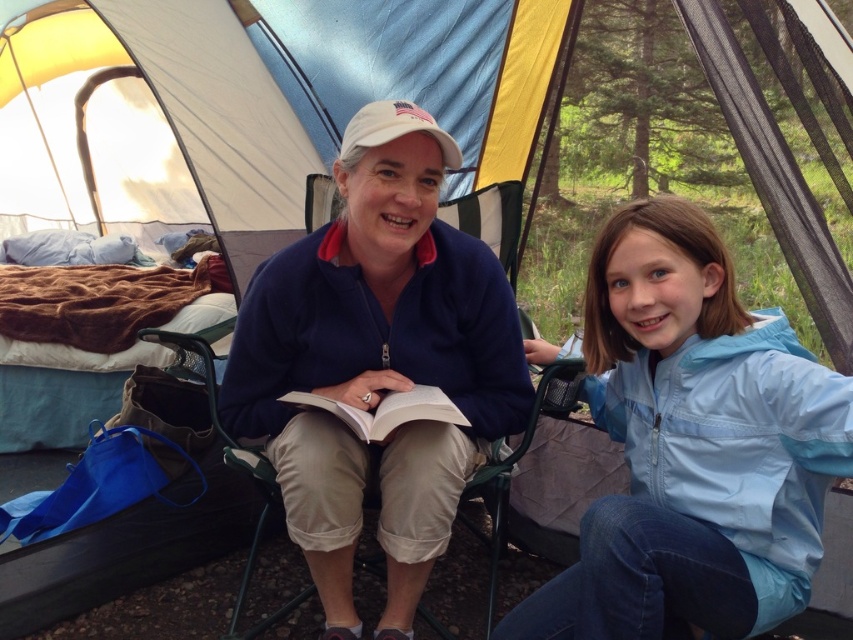
Is light blue nylon jacket at lower right shorter than navy fleece jacket at center?

Indeed, light blue nylon jacket at lower right has a lesser height compared to navy fleece jacket at center.

Which is below, light blue nylon jacket at lower right or navy fleece jacket at center?

light blue nylon jacket at lower right is lower down.

Identify the location of light blue nylon jacket at lower right. (693, 445).

Where is `light blue nylon jacket at lower right`? The height and width of the screenshot is (640, 853). light blue nylon jacket at lower right is located at coordinates (693, 445).

Is navy fleece jacket at center to the right of white paper book at center from the viewer's perspective?

Indeed, navy fleece jacket at center is positioned on the right side of white paper book at center.

The width and height of the screenshot is (853, 640). Describe the element at coordinates (376, 362) in the screenshot. I see `navy fleece jacket at center` at that location.

Is point (415, 497) positioned behind point (379, 435)?

Yes, point (415, 497) is behind point (379, 435).

In order to click on navy fleece jacket at center in this screenshot , I will do `click(376, 362)`.

Can you confirm if light blue nylon jacket at lower right is positioned below white paper book at center?

Correct, light blue nylon jacket at lower right is located below white paper book at center.

Is light blue nylon jacket at lower right wider than white paper book at center?

Yes.

Identify the location of light blue nylon jacket at lower right. (693, 445).